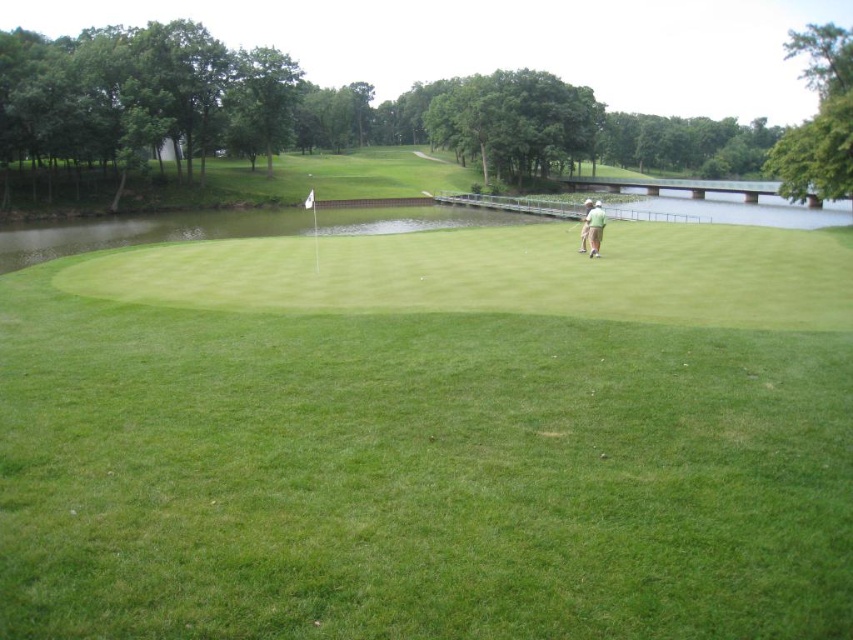
Question: Which point appears closest to the camera in this image?

Choices:
 (A) click(575, 225)
 (B) click(424, 561)

Answer: (B)

Question: Among these objects, which one is nearest to the camera?

Choices:
 (A) green fabric shirt at right
 (B) metallic silver golf club at right

Answer: (A)

Question: Estimate the real-world distances between objects in this image. Which object is farther from the metallic silver golf club at right?

Choices:
 (A) green fabric shirt at right
 (B) green grassy golf course at center

Answer: (B)

Question: Does green fabric shirt at right appear under metallic silver golf club at right?

Choices:
 (A) yes
 (B) no

Answer: (B)

Question: Can you confirm if green grassy golf course at center is positioned below green fabric shirt at right?

Choices:
 (A) no
 (B) yes

Answer: (B)

Question: Does green grassy golf course at center have a smaller size compared to metallic silver golf club at right?

Choices:
 (A) yes
 (B) no

Answer: (B)